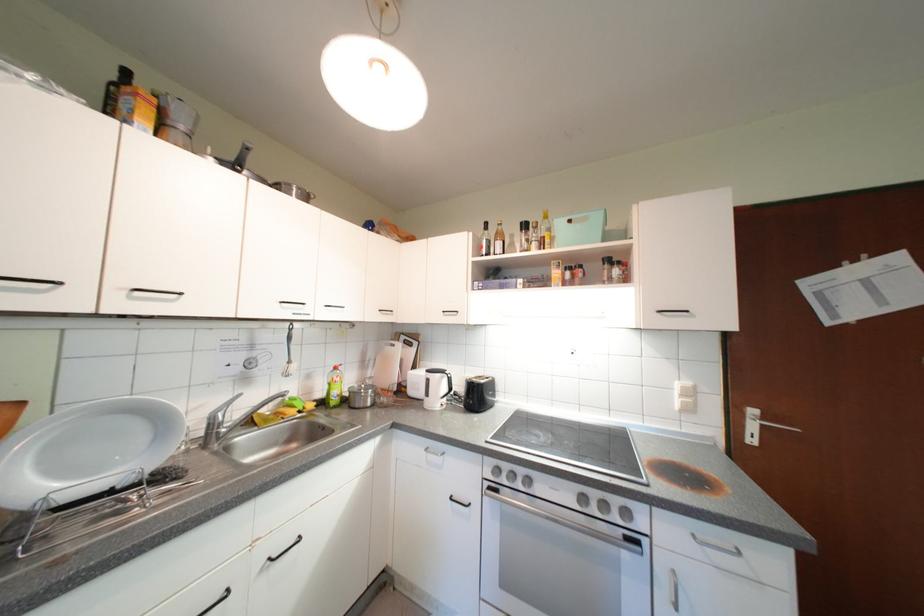
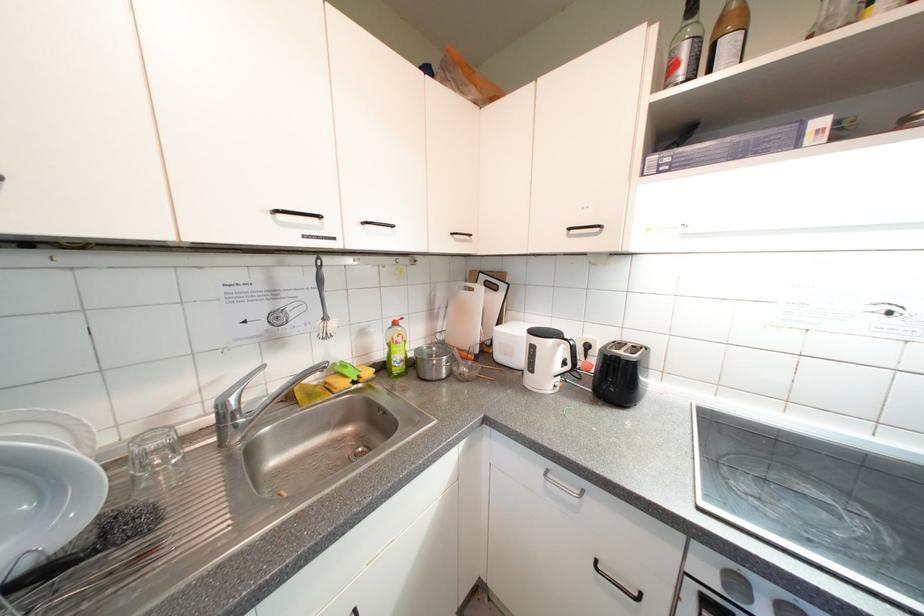
The point at [343,394] is marked in the first image. Where is the corresponding point in the second image?

(406, 358)